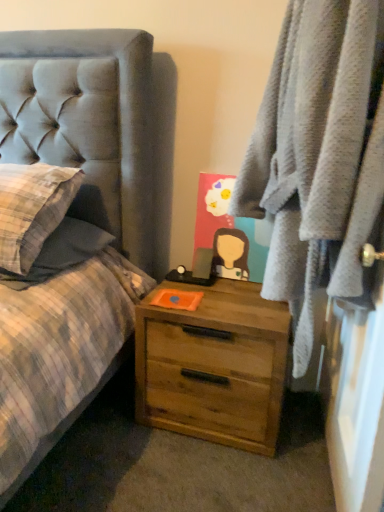
Find the location of a particular element. The width and height of the screenshot is (384, 512). wooden chest of drawers at lower right is located at coordinates (213, 366).

Image resolution: width=384 pixels, height=512 pixels. What do you see at coordinates (213, 366) in the screenshot?
I see `wooden chest of drawers at lower right` at bounding box center [213, 366].

The height and width of the screenshot is (512, 384). Find the location of `soft gray robe at right`. soft gray robe at right is located at coordinates coord(317,153).

This screenshot has width=384, height=512. Describe the element at coordinates (317, 153) in the screenshot. I see `soft gray robe at right` at that location.

Find the location of a particular element. The height and width of the screenshot is (512, 384). wooden chest of drawers at lower right is located at coordinates (213, 366).

Between wooden chest of drawers at lower right and soft gray robe at right, which one appears on the right side from the viewer's perspective?

soft gray robe at right is more to the right.

Relative to soft gray robe at right, is wooden chest of drawers at lower right in front or behind?

In the image, wooden chest of drawers at lower right appears behind soft gray robe at right.

Which is closer to the camera, (164, 402) or (324, 209)?

The point (324, 209) is closer to the camera.

From the image's perspective, between wooden chest of drawers at lower right and soft gray robe at right, who is located below?

From the image's view, wooden chest of drawers at lower right is below.

From a real-world perspective, is wooden chest of drawers at lower right above or below soft gray robe at right?

Clearly, from a real-world perspective, wooden chest of drawers at lower right is below soft gray robe at right.

Does wooden chest of drawers at lower right have a lesser width compared to soft gray robe at right?

In fact, wooden chest of drawers at lower right might be wider than soft gray robe at right.

Considering the sizes of objects wooden chest of drawers at lower right and soft gray robe at right in the image provided, who is shorter, wooden chest of drawers at lower right or soft gray robe at right?

wooden chest of drawers at lower right.

Can you confirm if wooden chest of drawers at lower right is bigger than soft gray robe at right?

No.

Is soft gray robe at right completely or partially inside wooden chest of drawers at lower right?

No, wooden chest of drawers at lower right does not contain soft gray robe at right.

Is wooden chest of drawers at lower right far from soft gray robe at right?

They are positioned close to each other.

Could you tell me if wooden chest of drawers at lower right is turned towards soft gray robe at right?

No, wooden chest of drawers at lower right is not facing towards soft gray robe at right.

You are a GUI agent. You are given a task and a screenshot of the screen. Output one action in this format:
    pyautogui.click(x=<x>, y=<y>)
    Task: Click on the clothing above the wooden chest of drawers at lower right (from a real-world perspective)
    
    Given the screenshot: What is the action you would take?
    pyautogui.click(x=317, y=153)

Is soft gray robe at right to the left or to the right of wooden chest of drawers at lower right in the image?

Clearly, soft gray robe at right is on the right of wooden chest of drawers at lower right in the image.

Considering their positions, is soft gray robe at right located in front of or behind wooden chest of drawers at lower right?

Visually, soft gray robe at right is located in front of wooden chest of drawers at lower right.

Which point is more forward, [338,210] or [144,392]?

The point [338,210] is more forward.

From the image's perspective, is soft gray robe at right above or below wooden chest of drawers at lower right?

soft gray robe at right is situated higher than wooden chest of drawers at lower right in the image.

From a real-world perspective, between soft gray robe at right and wooden chest of drawers at lower right, who is vertically lower?

From a 3D spatial view, wooden chest of drawers at lower right is below.

Which object is thinner, soft gray robe at right or wooden chest of drawers at lower right?

soft gray robe at right is thinner.

Is soft gray robe at right taller or shorter than wooden chest of drawers at lower right?

In the image, soft gray robe at right appears to be taller than wooden chest of drawers at lower right.

Can you confirm if soft gray robe at right is smaller than wooden chest of drawers at lower right?

Actually, soft gray robe at right might be larger than wooden chest of drawers at lower right.

Is soft gray robe at right not inside wooden chest of drawers at lower right?

Yes, soft gray robe at right is outside of wooden chest of drawers at lower right.

Is soft gray robe at right not near wooden chest of drawers at lower right?

No, there isn't a large distance between soft gray robe at right and wooden chest of drawers at lower right.

Is soft gray robe at right aimed at wooden chest of drawers at lower right?

No, soft gray robe at right does not turn towards wooden chest of drawers at lower right.

How far apart are soft gray robe at right and wooden chest of drawers at lower right?

soft gray robe at right is 44.08 centimeters away from wooden chest of drawers at lower right.

I want to click on the chest of drawers beneath the soft gray robe at right (from a real-world perspective), so click(x=213, y=366).

Find the location of a particular element. Image resolution: width=384 pixels, height=512 pixels. the chest of drawers located underneath the soft gray robe at right (from a real-world perspective) is located at coordinates (213, 366).

In order to click on the chest of drawers behind the soft gray robe at right in this screenshot , I will do `click(213, 366)`.